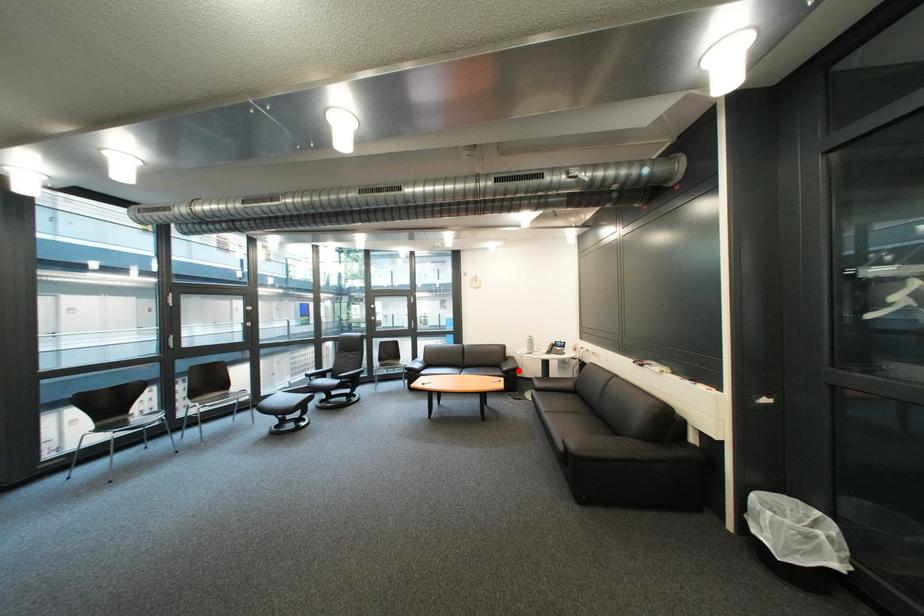
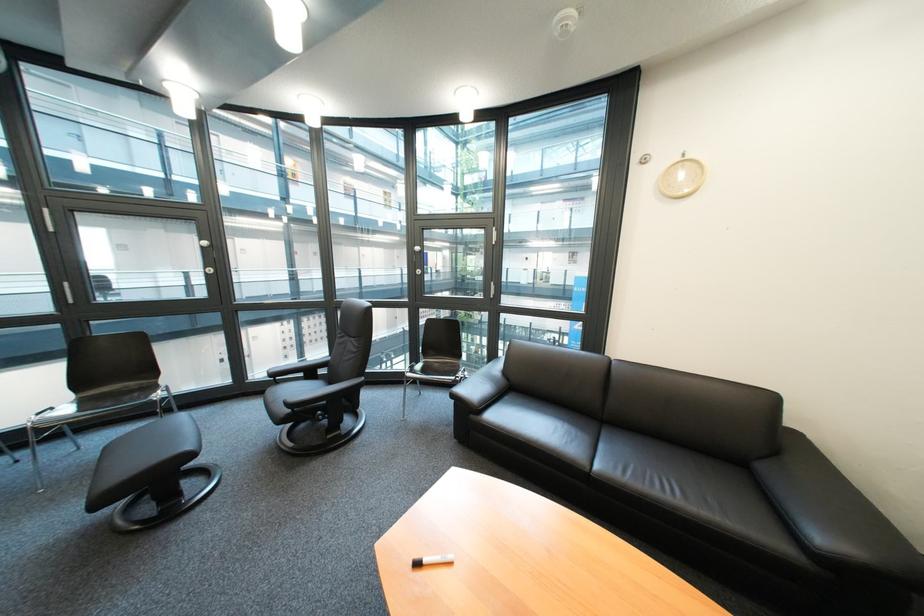
In the second image, find the point that corresponds to the highlighted location in the first image.

(833, 540)